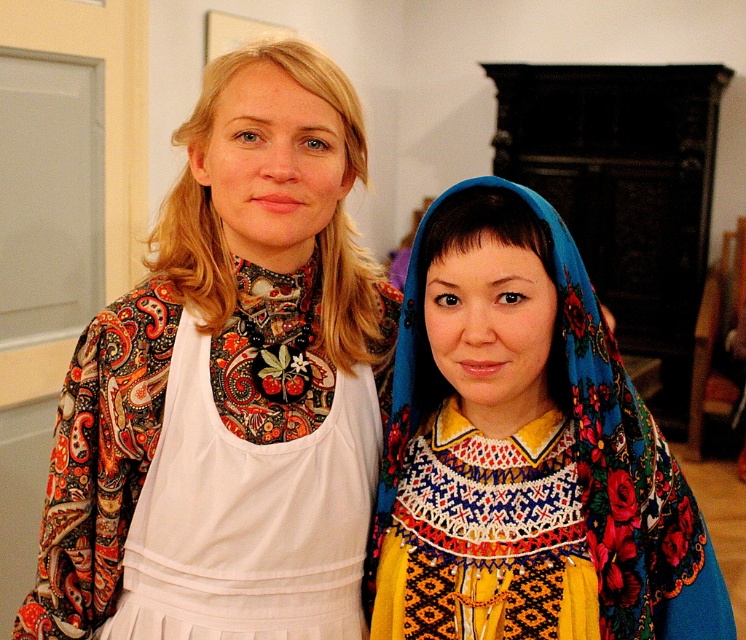
You are a photographer standing 5 feet away from the camera. You want to take a closeup shot of the matte floral kimono at center. Can you reach it without moving closer?

The matte floral kimono at center is 3.39 feet from the camera. Since you are 5 feet away from the camera, you are farther away than the kimono, so you cannot reach it without moving closer.